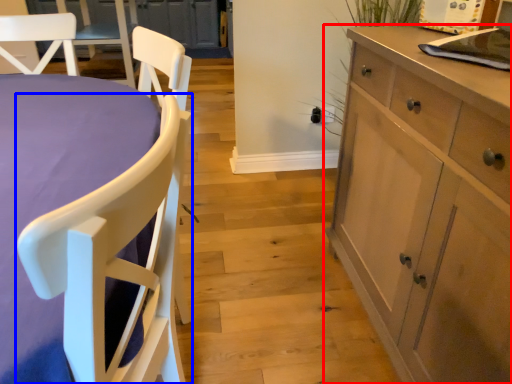
Question: Which object appears farthest to the camera in this image, cabinetry (highlighted by a red box) or chair (highlighted by a blue box)?

Choices:
 (A) cabinetry
 (B) chair

Answer: (A)